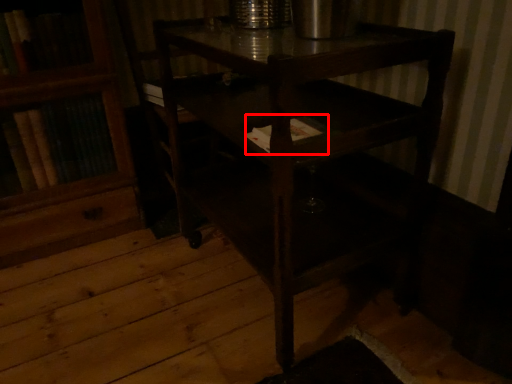
Question: Where is book (annotated by the red box) located in relation to table in the image?

Choices:
 (A) left
 (B) right

Answer: (A)